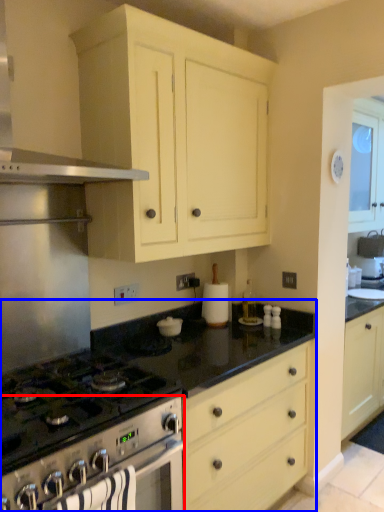
Question: Which point is closer to the camera, oven (highlighted by a red box) or countertop (highlighted by a blue box)?

Choices:
 (A) oven
 (B) countertop

Answer: (A)